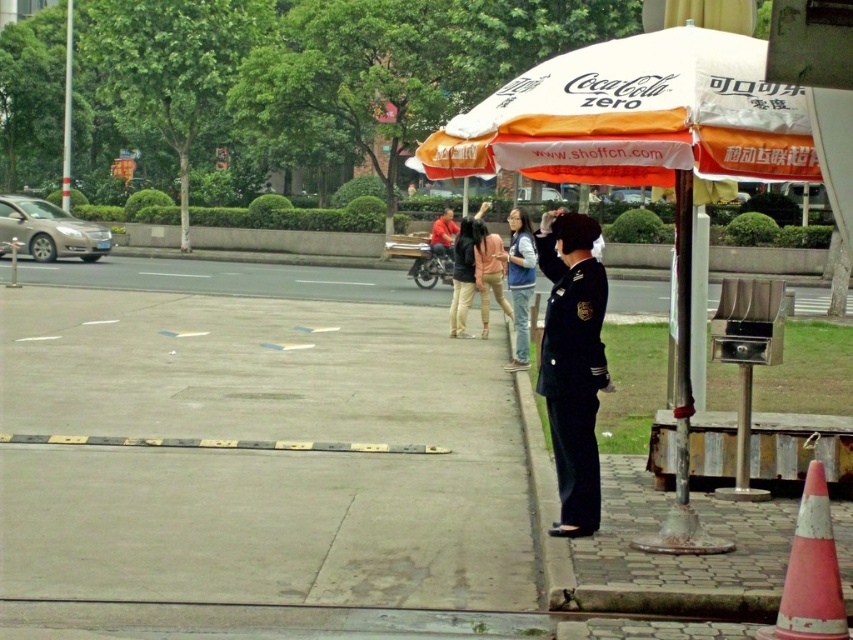
You are a delivery person who needs to place a small package on the ground between the metallic pole at right and the matte red jacket at center. Is there enough space between them to place the package?

The metallic pole at right is positioned on the right side of matte red jacket at center, so there is space between them to place the package.

You are standing at the position of the security guard and want to throw a small ball to a friend who is standing at point (581, 282). There is an obstacle at point (621, 67). Will your ball pass over the obstacle?

Point (621, 67) is closer to the camera than point (581, 282). Since the obstacle is closer to you, your ball will pass over the obstacle before reaching your friend.

From the picture: You are a delivery person needing to pass through the area between the metallic pole at right and the matte red jacket at center. Can your 1.2m wide delivery cart fit through the space?

The metallic pole at right is wider than the matte red jacket at center. However, the exact width difference isn not specified. Without knowing the actual widths, it is impossible to determine if the 1.2m wide delivery cart can fit through the space between them.